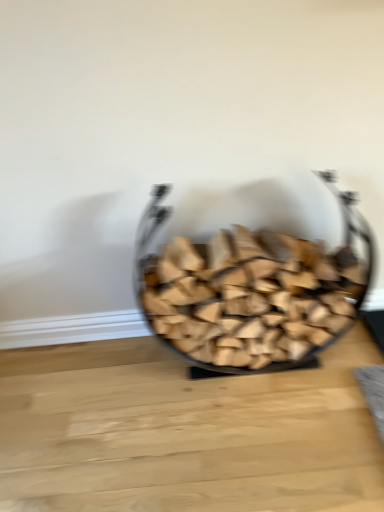
Question: From a real-world perspective, is wooden logs at center located higher than natural wood table at center?

Choices:
 (A) no
 (B) yes

Answer: (B)

Question: Considering the relative sizes of wooden logs at center and natural wood table at center in the image provided, is wooden logs at center thinner than natural wood table at center?

Choices:
 (A) yes
 (B) no

Answer: (A)

Question: From a real-world perspective, is wooden logs at center below natural wood table at center?

Choices:
 (A) no
 (B) yes

Answer: (A)

Question: Can you confirm if wooden logs at center is positioned to the left of natural wood table at center?

Choices:
 (A) no
 (B) yes

Answer: (A)

Question: Does wooden logs at center appear on the right side of natural wood table at center?

Choices:
 (A) no
 (B) yes

Answer: (B)

Question: Is natural wood table at center at the back of wooden logs at center?

Choices:
 (A) yes
 (B) no

Answer: (B)

Question: Is natural wood table at center beside wooden logs at center?

Choices:
 (A) no
 (B) yes

Answer: (A)

Question: Is natural wood table at center to the right of wooden logs at center from the viewer's perspective?

Choices:
 (A) no
 (B) yes

Answer: (A)

Question: Can we say natural wood table at center lies outside wooden logs at center?

Choices:
 (A) yes
 (B) no

Answer: (A)

Question: From a real-world perspective, does natural wood table at center stand above wooden logs at center?

Choices:
 (A) no
 (B) yes

Answer: (A)

Question: Is natural wood table at center behind wooden logs at center?

Choices:
 (A) no
 (B) yes

Answer: (B)

Question: Does natural wood table at center have a greater height compared to wooden logs at center?

Choices:
 (A) no
 (B) yes

Answer: (A)

Question: Considering the positions of wooden logs at center and natural wood table at center in the image, is wooden logs at center taller or shorter than natural wood table at center?

Choices:
 (A) short
 (B) tall

Answer: (B)